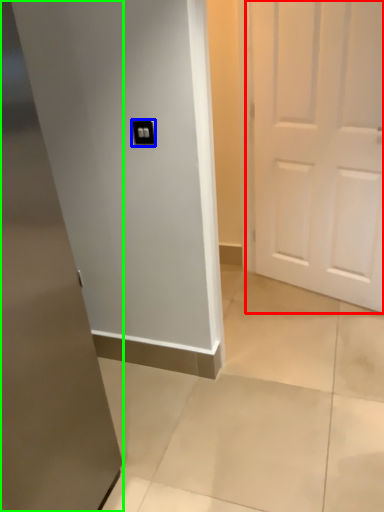
Question: Which object is positioned farthest from door (highlighted by a red box)? Select from light switch (highlighted by a blue box) and door (highlighted by a green box).

Choices:
 (A) light switch
 (B) door

Answer: (B)